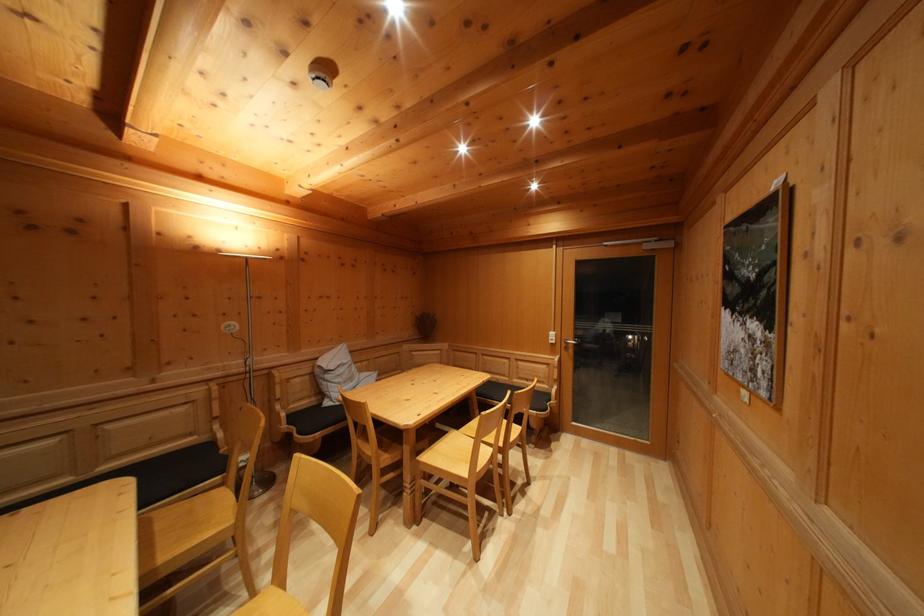
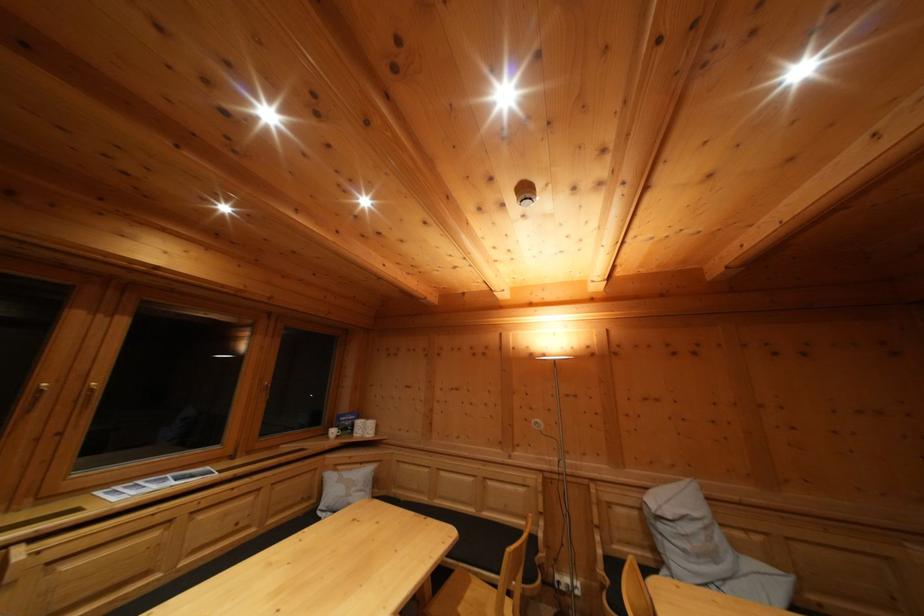
Where in the second image is the point corresponding to (x=197, y=440) from the first image?

(532, 525)